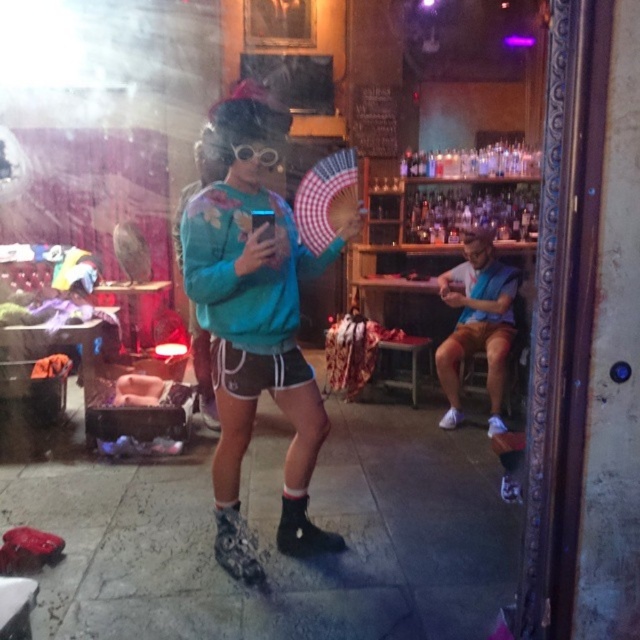
You are a photographer trying to capture the person in the teal fabric sweatshirt at center and the clear plastic goggles at center. Since both are at the center, can you focus on both subjects at the same time?

The teal fabric sweatshirt at center is in front of the clear plastic goggles at center, so focusing on both at the same time may be challenging as they are at different depths.